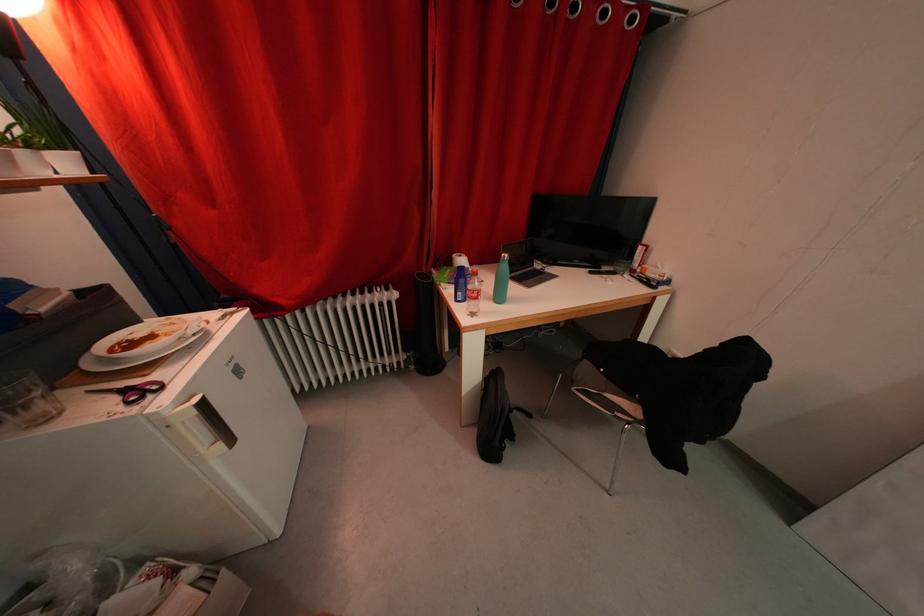
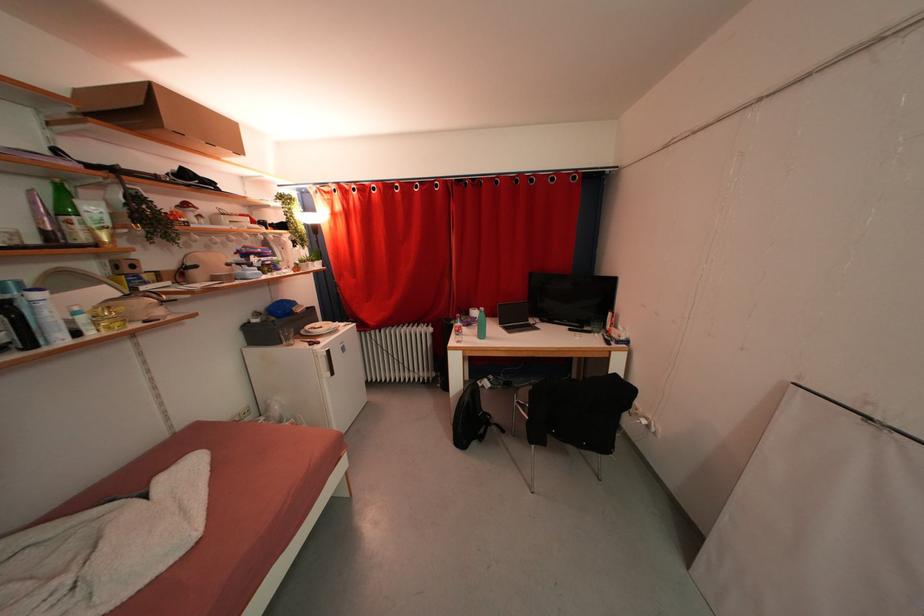
In a continuous first-person perspective shot, in which direction is the camera moving?

The cameraman moved toward right, backward.